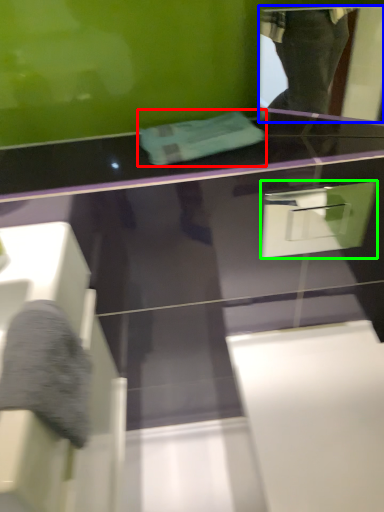
Question: Which object is positioned closest to towel (highlighted by a red box)? Select from mirror (highlighted by a blue box) and drawer (highlighted by a green box).

Choices:
 (A) mirror
 (B) drawer

Answer: (B)